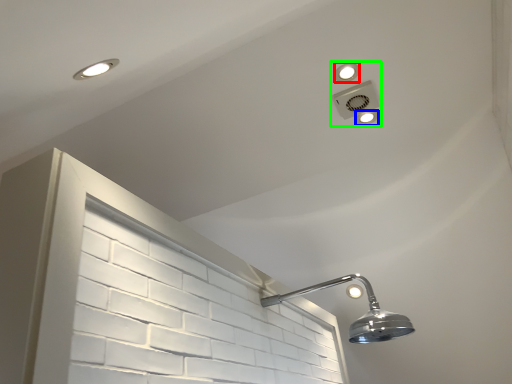
Question: Which object is the closest to the dot (highlighted by a red box)? Choose among these: dot (highlighted by a blue box) or fixture (highlighted by a green box).

Choices:
 (A) dot
 (B) fixture

Answer: (B)